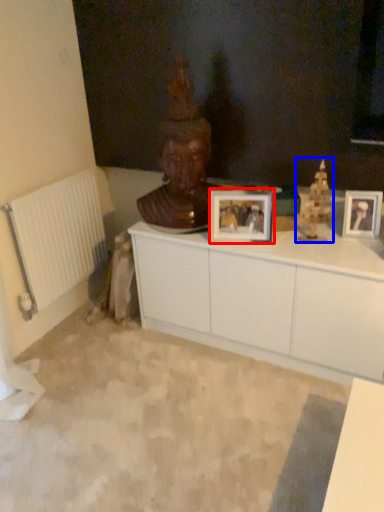
Question: Which object appears farthest to the camera in this image, picture frame (highlighted by a red box) or toy (highlighted by a blue box)?

Choices:
 (A) picture frame
 (B) toy

Answer: (A)